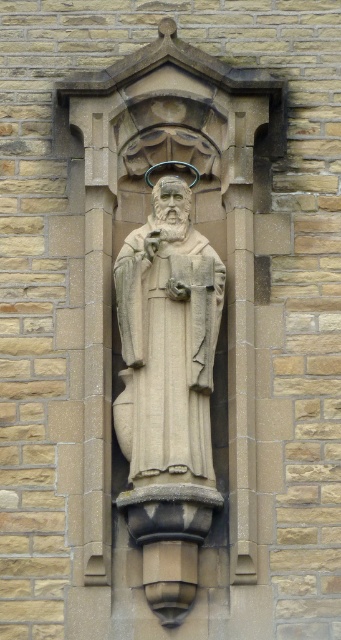
You are an art conservator assessing the stone relief sculpture. The beige stone statue at center and the smooth stone robe at center are part of the same artwork. Which object is wider?

The beige stone statue at center is wider than the smooth stone robe at center.

You are an art conservator examining the stone relief sculpture. You notice the beige stone statue at center and the smooth stone robe at center. Which object is positioned closer to your viewpoint?

The beige stone statue at center is closer to the viewer than the smooth stone robe at center.

You are an art conservator assessing the stone relief sculpture. You need to determine which object is taller between the beige stone statue at center and the smooth stone robe at center. Which one is taller?

The beige stone statue at center is taller than the smooth stone robe at center according to the description.